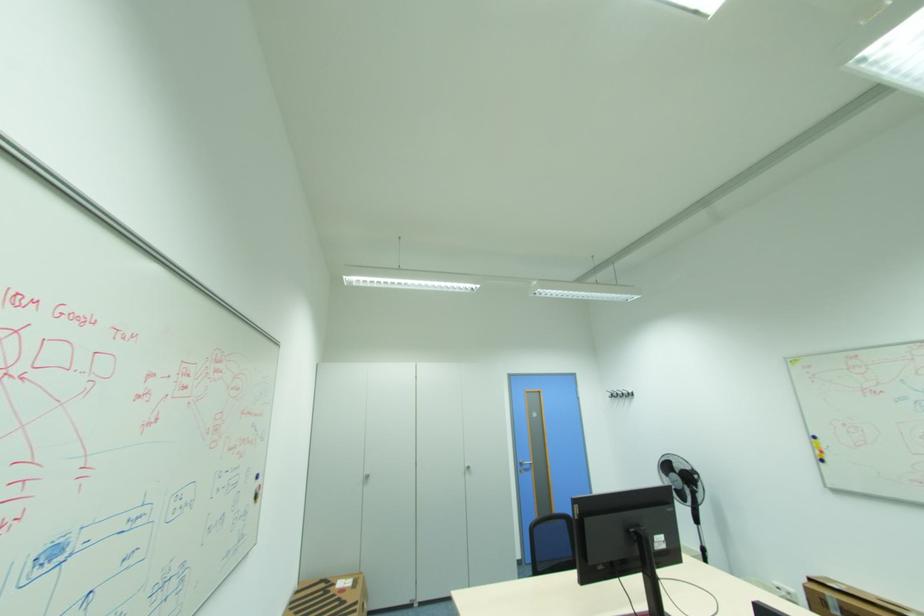
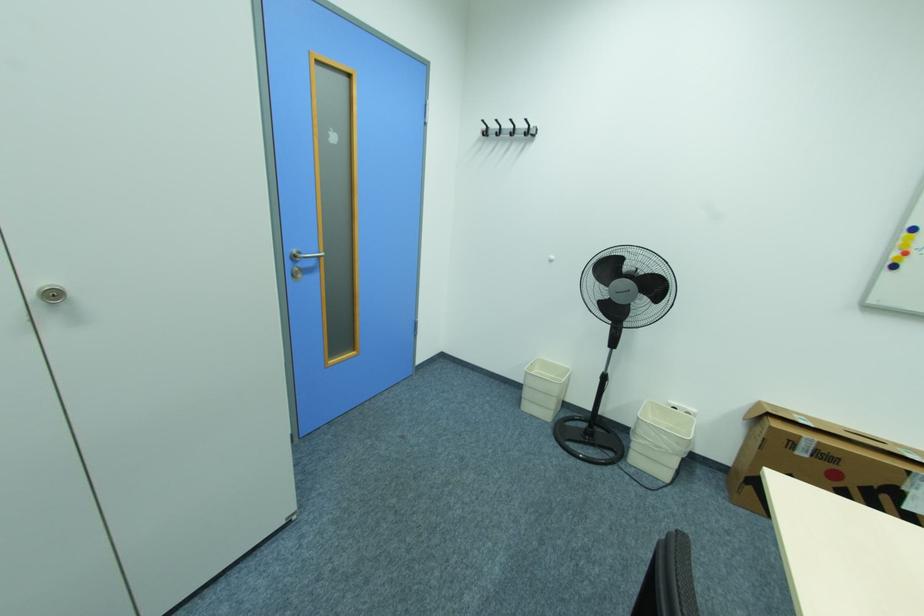
In the second image, find the point that corresponds to point (527, 461) in the first image.

(300, 252)